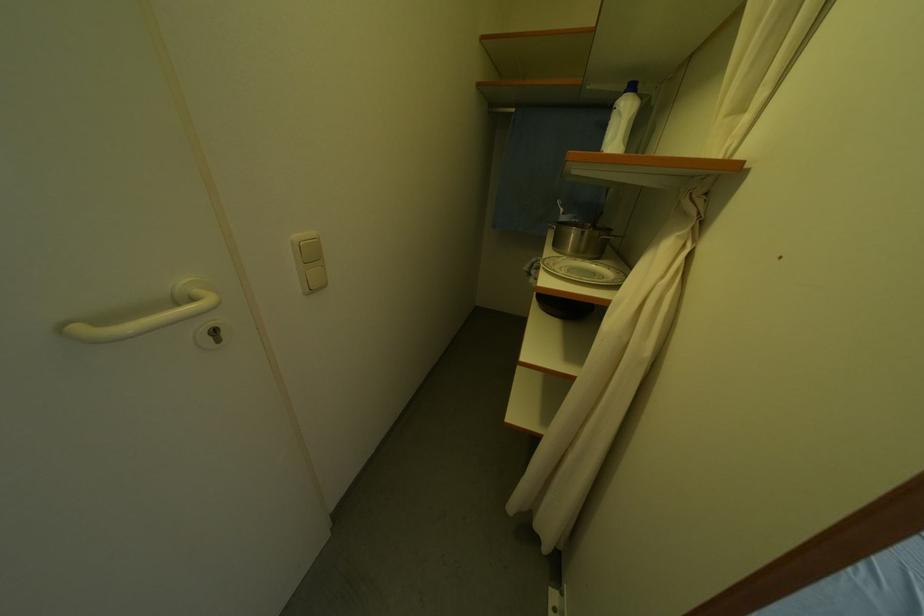
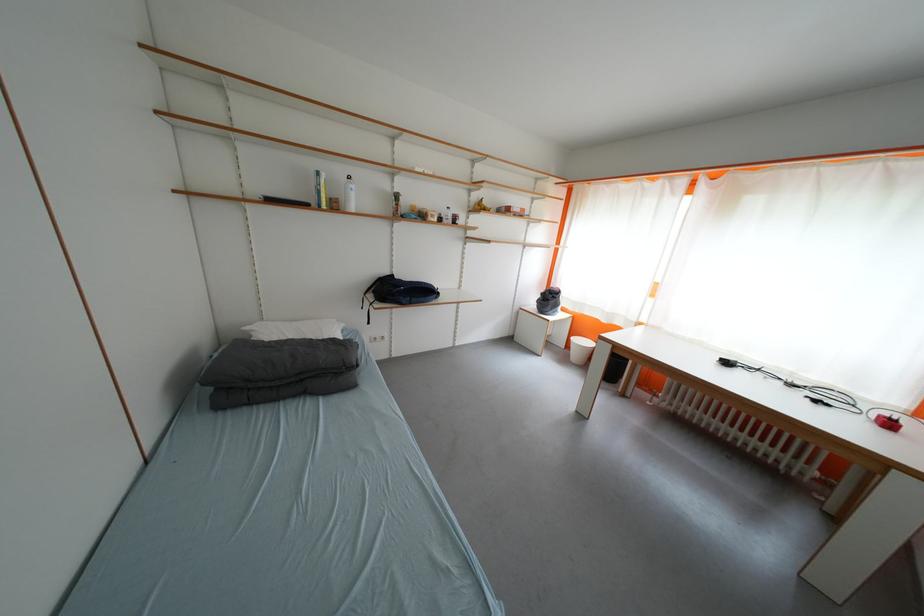
Question: How did the camera likely rotate?

Choices:
 (A) Left
 (B) Right
 (C) Up
 (D) Down

Answer: (B)